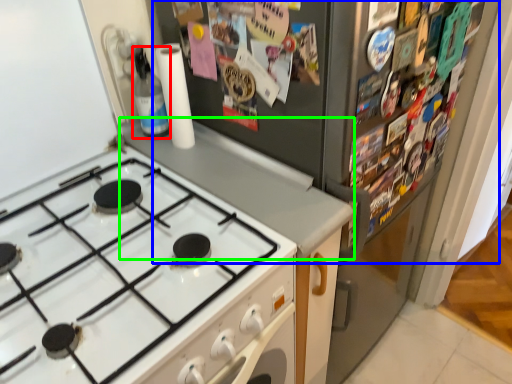
Question: Considering the real-world distances, which object is closest to bottle (highlighted by a red box)? fridge (highlighted by a blue box) or counter top (highlighted by a green box).

Choices:
 (A) fridge
 (B) counter top

Answer: (B)